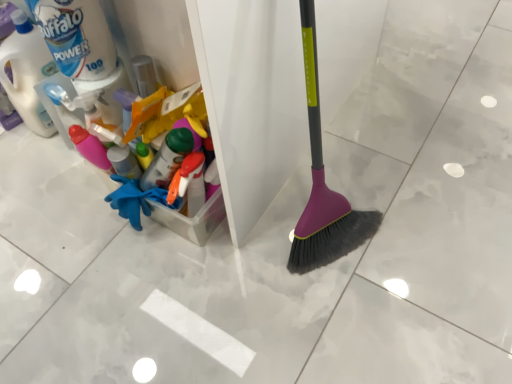
Image resolution: width=512 pixels, height=384 pixels. What do you see at coordinates (27, 73) in the screenshot? I see `matte white bottle at left` at bounding box center [27, 73].

Measure the distance between matte white bottle at left and camera.

matte white bottle at left is 3.83 feet away from camera.

Where is `matte white bottle at left`? This screenshot has height=384, width=512. matte white bottle at left is located at coordinates (27, 73).

At what (x,y) coordinates should I click in order to perform the action: click on matte white bottle at upper left. Please return your answer as a coordinate pair (x, y). This screenshot has width=512, height=384. Looking at the image, I should click on (76, 37).

What do you see at coordinates (76, 37) in the screenshot? The height and width of the screenshot is (384, 512). I see `matte white bottle at upper left` at bounding box center [76, 37].

Find the location of a particular element. The height and width of the screenshot is (384, 512). matte white bottle at left is located at coordinates (27, 73).

Considering the relative positions of matte white bottle at left and matte white bottle at upper left in the image provided, is matte white bottle at left to the left or to the right of matte white bottle at upper left?

In the image, matte white bottle at left appears on the left side of matte white bottle at upper left.

Who is more distant, matte white bottle at left or matte white bottle at upper left?

matte white bottle at left is further away from the camera.

Considering the positions of points (2, 51) and (42, 27), is point (2, 51) closer to camera compared to point (42, 27)?

No, (2, 51) is further to viewer.

From the image's perspective, is matte white bottle at left over matte white bottle at upper left?

No.

From the picture: From a real-world perspective, is matte white bottle at left physically below matte white bottle at upper left?

Indeed, from a real-world perspective, matte white bottle at left is positioned beneath matte white bottle at upper left.

Which object is wider, matte white bottle at left or matte white bottle at upper left?

Wider between the two is matte white bottle at left.

Between matte white bottle at left and matte white bottle at upper left, which one has more height?

matte white bottle at left is taller.

Is matte white bottle at left smaller than matte white bottle at upper left?

No, matte white bottle at left is not smaller than matte white bottle at upper left.

Would you say matte white bottle at upper left is part of matte white bottle at left's contents?

Answer: No, matte white bottle at upper left is not surrounded by matte white bottle at left.

Is matte white bottle at left positioned far away from matte white bottle at upper left?

That's not correct — matte white bottle at left is a little close to matte white bottle at upper left.

Is matte white bottle at left facing away from matte white bottle at upper left?

matte white bottle at left does not have its back to matte white bottle at upper left.

The height and width of the screenshot is (384, 512). What are the coordinates of `cleaning product above the matte white bottle at left (from the image's perspective)` in the screenshot? It's located at (76, 37).

Is matte white bottle at upper left to the left or to the right of matte white bottle at left in the image?

matte white bottle at upper left is positioned on matte white bottle at left's right side.

In the image, is matte white bottle at upper left positioned in front of or behind matte white bottle at left?

matte white bottle at upper left is in front of matte white bottle at left.

Which is less distant, (x=49, y=9) or (x=17, y=76)?

The point (x=49, y=9) is in front.

From the image's perspective, is matte white bottle at upper left on top of matte white bottle at left?

Yes, from the image's perspective, matte white bottle at upper left is over matte white bottle at left.

From a real-world perspective, which is physically below, matte white bottle at upper left or matte white bottle at left?

In real-world perspective, matte white bottle at left is lower.

Which object is thinner, matte white bottle at upper left or matte white bottle at left?

With smaller width is matte white bottle at upper left.

Does matte white bottle at upper left have a lesser height compared to matte white bottle at left?

Indeed, matte white bottle at upper left has a lesser height compared to matte white bottle at left.

Does matte white bottle at upper left have a smaller size compared to matte white bottle at left?

Yes, matte white bottle at upper left is smaller than matte white bottle at left.

Would you say matte white bottle at upper left is outside matte white bottle at left?

Yes, matte white bottle at upper left is located beyond the bounds of matte white bottle at left.

Is matte white bottle at upper left next to matte white bottle at left?

matte white bottle at upper left and matte white bottle at left are not in contact.

Based on the photo, does matte white bottle at upper left turn towards matte white bottle at left?

No, matte white bottle at upper left does not turn towards matte white bottle at left.

Measure the distance between matte white bottle at upper left and matte white bottle at left.

matte white bottle at upper left is 23.08 centimeters from matte white bottle at left.

This screenshot has height=384, width=512. What are the coordinates of `cleaning product on the right of the matte white bottle at left` in the screenshot? It's located at (76, 37).

This screenshot has width=512, height=384. Find the location of `bottle behind the matte white bottle at upper left`. bottle behind the matte white bottle at upper left is located at coordinates (27, 73).

I want to click on cleaning product located above the matte white bottle at left (from a real-world perspective), so click(x=76, y=37).